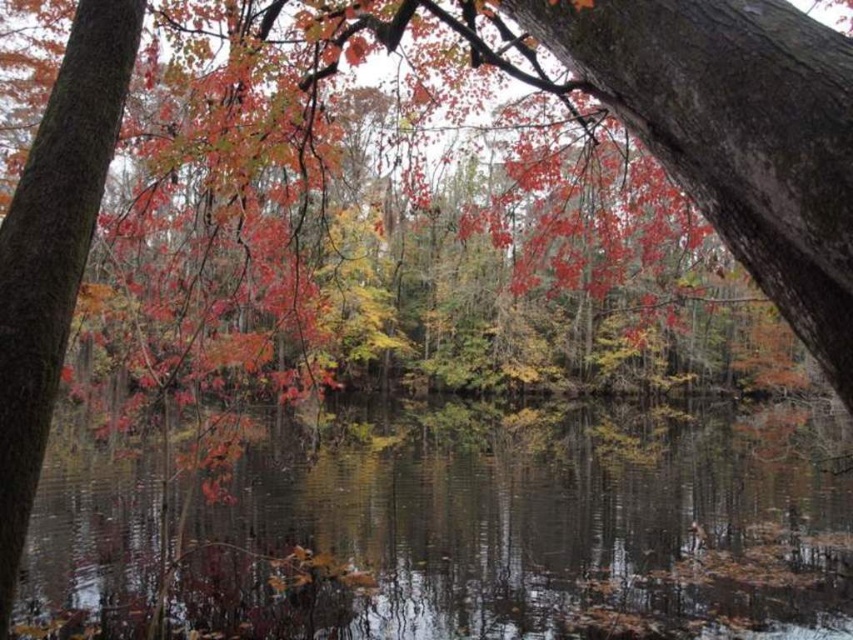
Question: Which point appears farthest from the camera in this image?

Choices:
 (A) (15, 417)
 (B) (122, 580)

Answer: (B)

Question: Can you confirm if smooth reflective water at center is positioned to the left of smooth bark tree trunk at left?

Choices:
 (A) yes
 (B) no

Answer: (B)

Question: Can you confirm if smooth reflective water at center is wider than smooth bark tree trunk at left?

Choices:
 (A) yes
 (B) no

Answer: (A)

Question: Does smooth reflective water at center have a smaller size compared to smooth bark tree trunk at left?

Choices:
 (A) no
 (B) yes

Answer: (A)